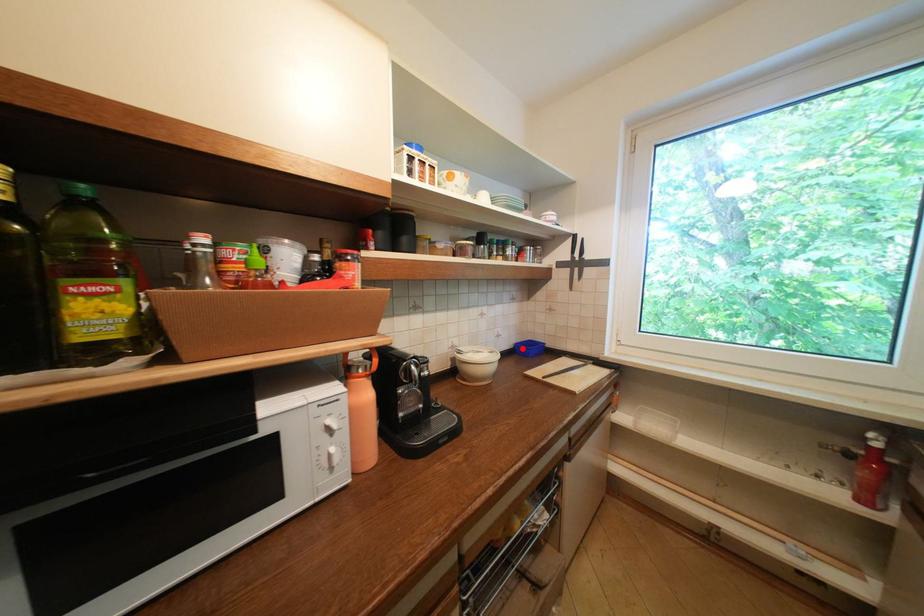
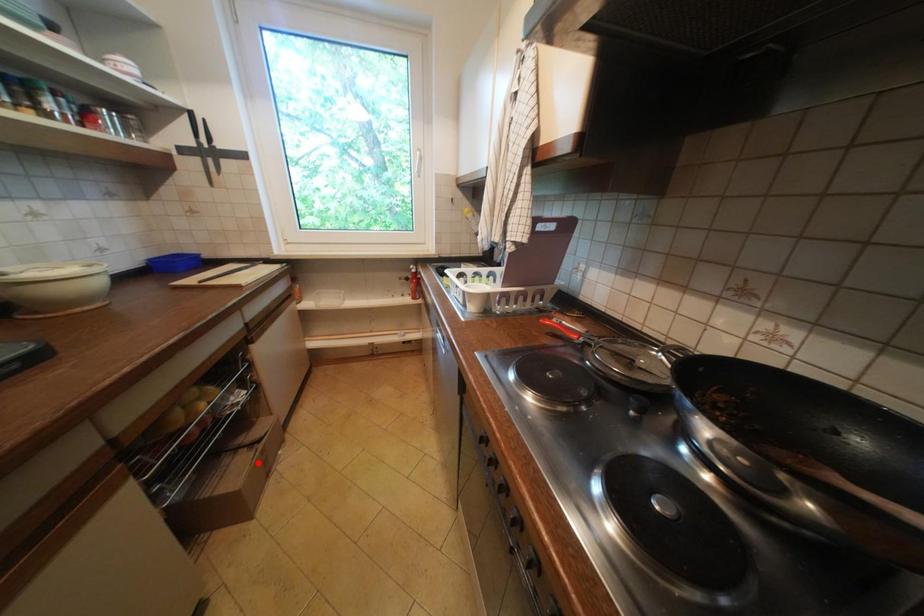
Looking at this image, I am providing you with two images of the same scene from different viewpoints. A red point is marked on the first image and another point is marked on the second image. Is the red point in image1 aligned with the point shown in image2?

No